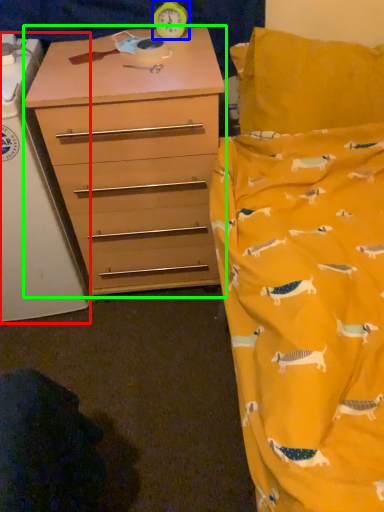
Question: Considering the real-world distances, which object is farthest from changing table (highlighted by a red box)? clock (highlighted by a blue box) or chest of drawers (highlighted by a green box)?

Choices:
 (A) clock
 (B) chest of drawers

Answer: (A)